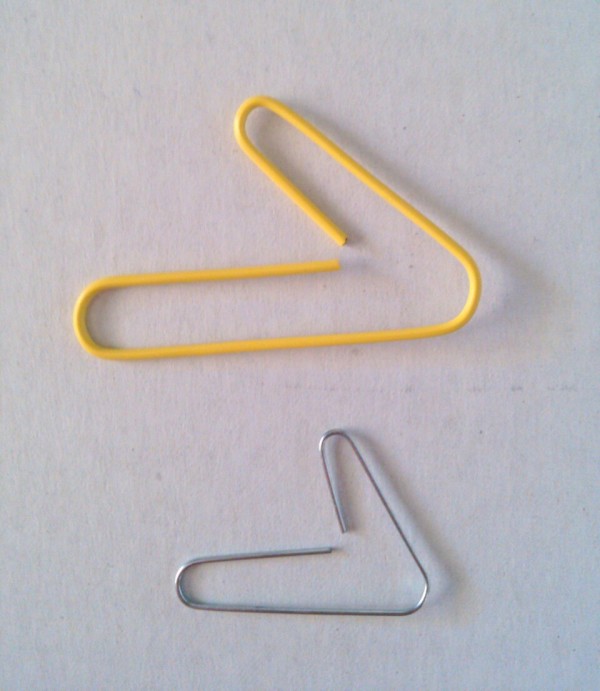
The image size is (600, 691). I want to click on table, so click(x=173, y=475).